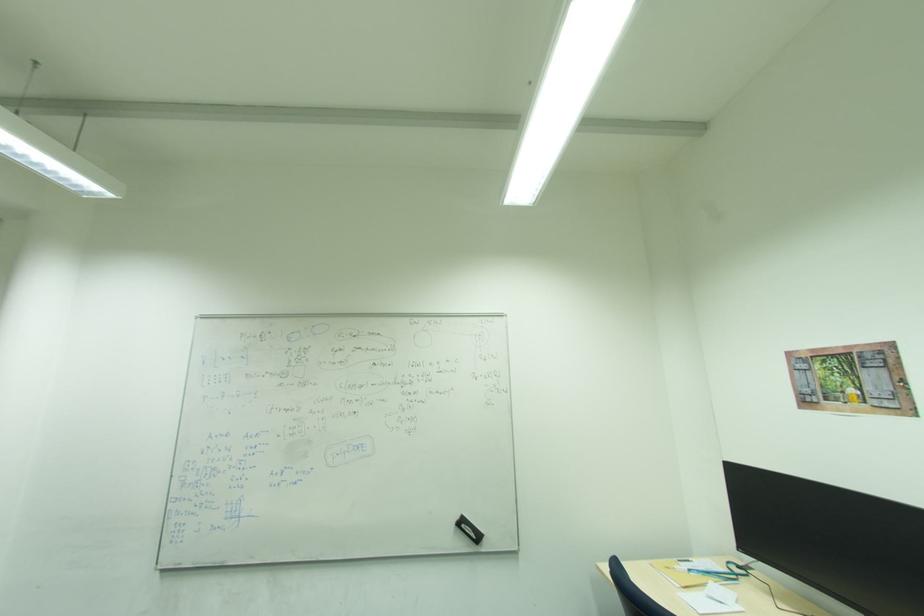
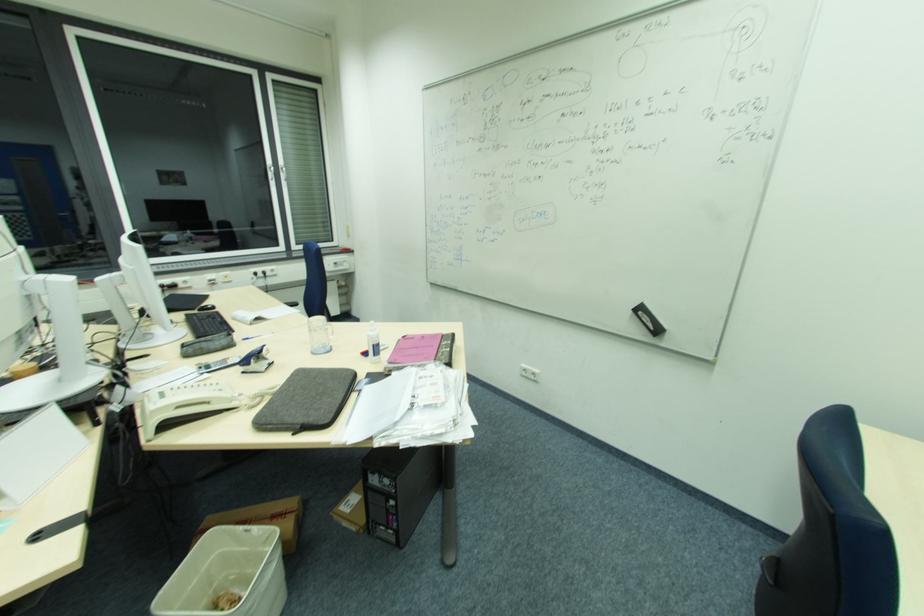
Where in the second image is the point corresponding to pixel 466 525 from the first image?

(643, 314)